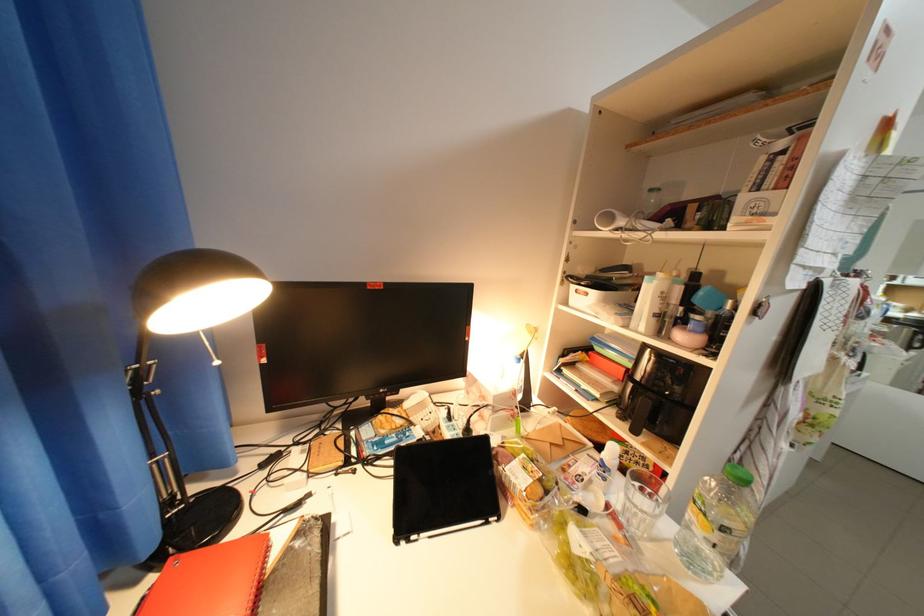
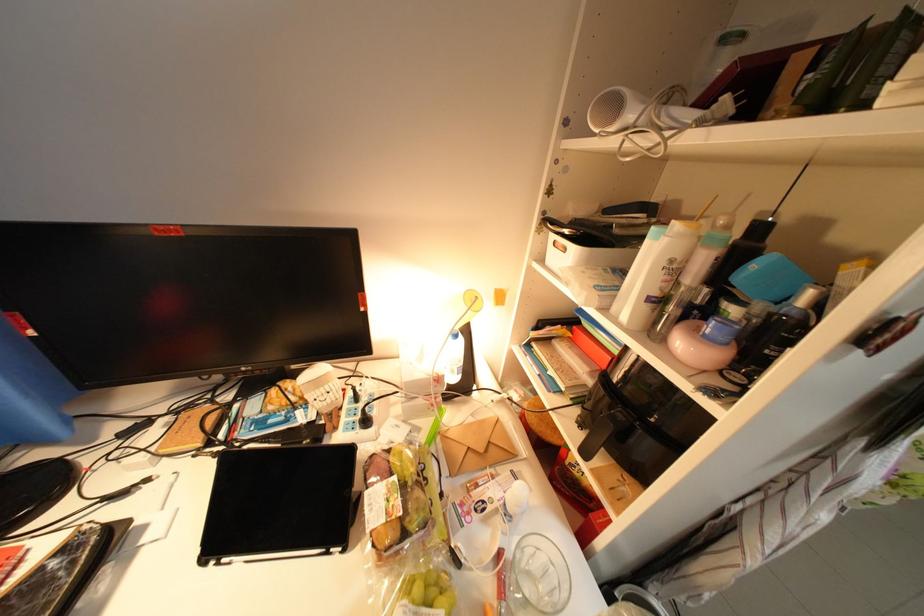
Question: The first image is from the beginning of the video and the second image is from the end. How did the camera likely rotate when shooting the video?

Choices:
 (A) Left
 (B) Right
 (C) Up
 (D) Down

Answer: (D)